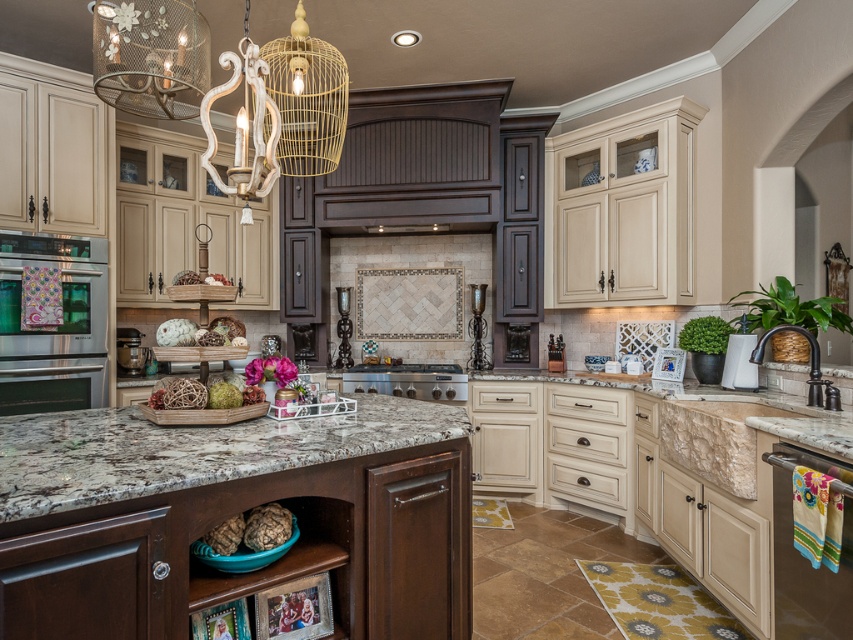
Question: Which object is positioned farthest from the satin silver stove at center?

Choices:
 (A) granite at center
 (B) stainless steel oven at left

Answer: (A)

Question: Which point appears closest to the camera in this image?

Choices:
 (A) (418, 436)
 (B) (422, 376)

Answer: (A)

Question: Does metallic stainless steel dishwasher at lower right have a larger size compared to satin silver stove at center?

Choices:
 (A) yes
 (B) no

Answer: (B)

Question: Is metallic stainless steel dishwasher at lower right behind satin silver stove at center?

Choices:
 (A) yes
 (B) no

Answer: (B)

Question: Which object is farther from the camera taking this photo?

Choices:
 (A) satin silver stove at center
 (B) metallic stainless steel dishwasher at lower right
 (C) granite at center
 (D) stainless steel oven at left

Answer: (A)

Question: Can you confirm if stainless steel oven at left is positioned above metallic stainless steel dishwasher at lower right?

Choices:
 (A) yes
 (B) no

Answer: (A)